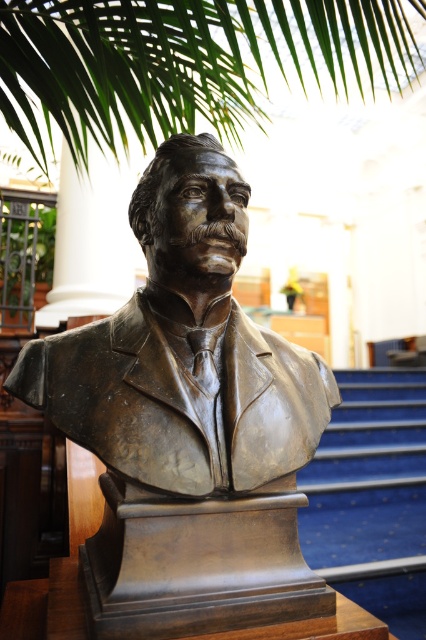
Question: Which object is closer to the camera taking this photo?

Choices:
 (A) blue carpet at center
 (B) bronze bust at center

Answer: (B)

Question: Where is bronze bust at center located in relation to blue carpet at center in the image?

Choices:
 (A) below
 (B) above

Answer: (B)

Question: Is bronze bust at center positioned before blue carpet at center?

Choices:
 (A) yes
 (B) no

Answer: (A)

Question: Which point is farther to the camera?

Choices:
 (A) (279, 483)
 (B) (336, 580)

Answer: (B)

Question: Does bronze bust at center have a lesser width compared to blue carpet at center?

Choices:
 (A) yes
 (B) no

Answer: (A)

Question: Which object appears farthest from the camera in this image?

Choices:
 (A) bronze bust at center
 (B) blue carpet at center

Answer: (B)